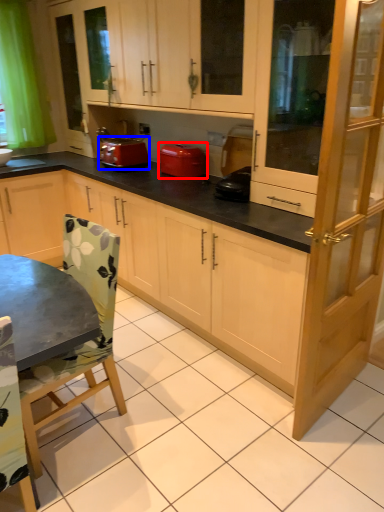
Question: Which object appears closest to the camera in this image, home appliance (highlighted by a red box) or kitchen appliance (highlighted by a blue box)?

Choices:
 (A) home appliance
 (B) kitchen appliance

Answer: (A)